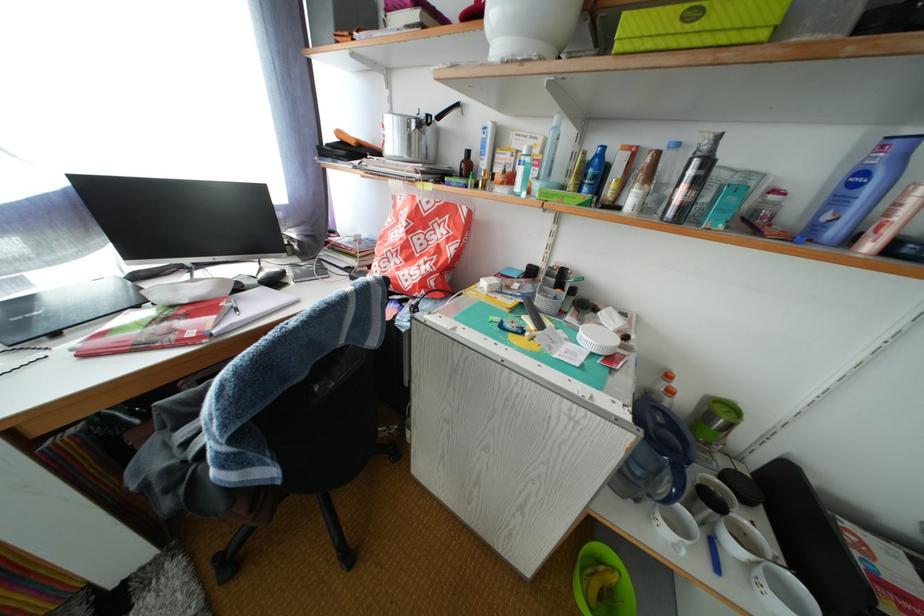
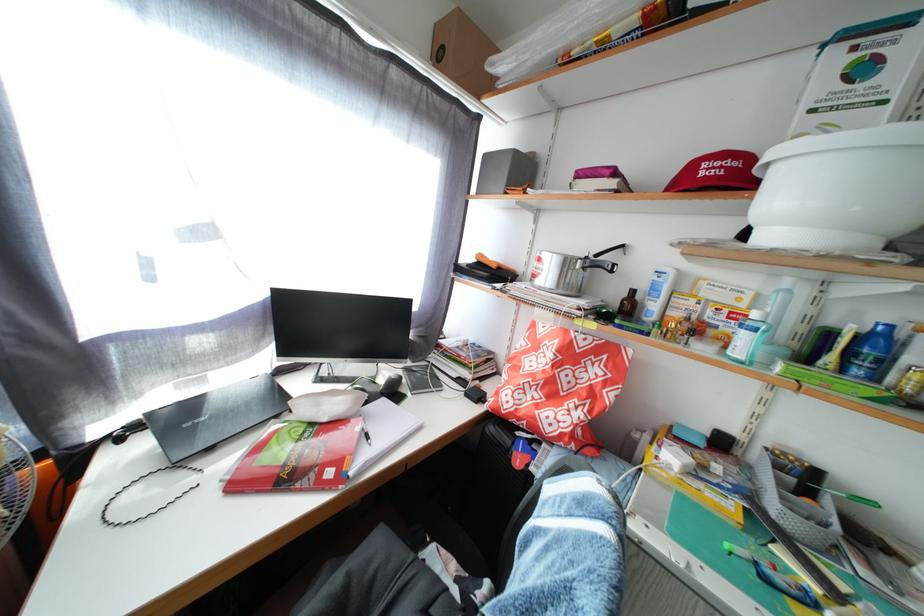
Where in the second image is the point corresponding to point 447,124 from the first image?

(605, 262)